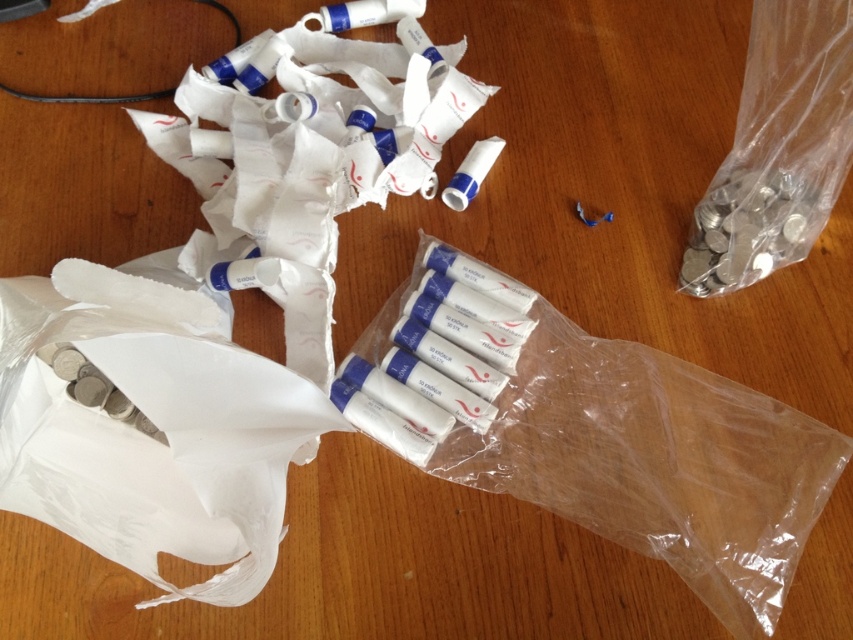
Question: Among these points, which one is nearest to the camera?

Choices:
 (A) (277, 403)
 (B) (424, 444)

Answer: (A)

Question: Which point is farther from the camera taking this photo?

Choices:
 (A) (274, 477)
 (B) (793, 534)

Answer: (B)

Question: Is clear plastic bag at center to the left of white paper bag at lower left from the viewer's perspective?

Choices:
 (A) yes
 (B) no

Answer: (B)

Question: Can you confirm if clear plastic bag at center is thinner than white paper bag at lower left?

Choices:
 (A) yes
 (B) no

Answer: (B)

Question: Does clear plastic bag at center appear on the right side of white paper bag at lower left?

Choices:
 (A) yes
 (B) no

Answer: (A)